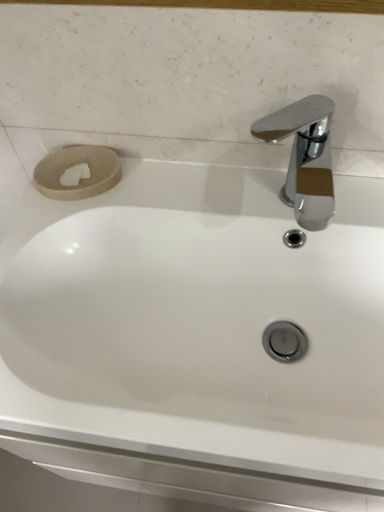
You are a GUI agent. You are given a task and a screenshot of the screen. Output one action in this format:
    pyautogui.click(x=<x>, y=<y>)
    Task: Click on the free location in front of beige matte toilet paper at upper left
    The image size is (384, 512).
    Given the screenshot: What is the action you would take?
    pyautogui.click(x=56, y=232)